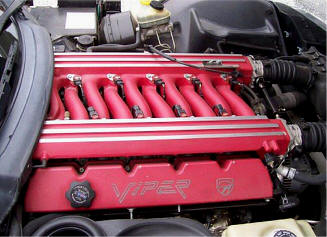
This screenshot has width=327, height=237. I want to click on plugs, so click(x=163, y=80), click(x=119, y=80), click(x=77, y=81).